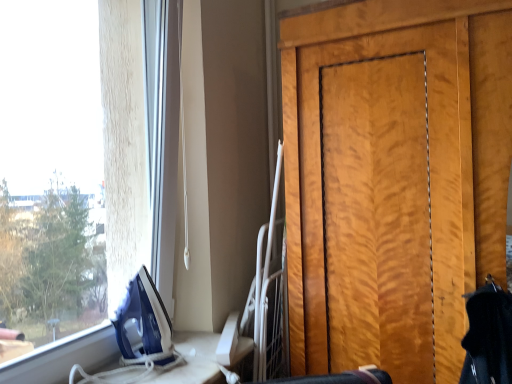
You are a GUI agent. You are given a task and a screenshot of the screen. Output one action in this format:
    pyautogui.click(x=<x>, y=<y>)
    Task: Click on the empty space that is ontop of white plastic table at lower left (from a real-world perspective)
    This screenshot has width=512, height=384.
    Given the screenshot: What is the action you would take?
    pyautogui.click(x=167, y=366)